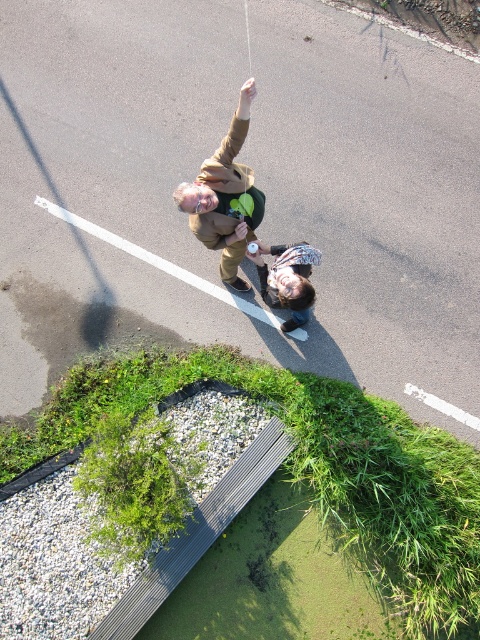
Between green grass at lower left and brown suede jacket at upper center, which one has more height?

green grass at lower left

Between green grass at lower left and brown suede jacket at upper center, which one is positioned higher?

Positioned higher is brown suede jacket at upper center.

Is point (371, 448) farther from camera compared to point (232, 180)?

Yes, point (371, 448) is behind point (232, 180).

Where is `green grass at lower left`? green grass at lower left is located at coordinates (286, 467).

Based on the photo, does green grass at lower left have a larger size compared to matte brown jacket at center?

Indeed, green grass at lower left has a larger size compared to matte brown jacket at center.

Who is more forward, (402, 417) or (295, 243)?

Point (402, 417) is in front.

Does point (247, 372) come behind point (277, 264)?

Yes, it is behind point (277, 264).

The height and width of the screenshot is (640, 480). Find the location of `green grass at lower left`. green grass at lower left is located at coordinates (286, 467).

Is brown suede jacket at upper center taller than matte brown jacket at center?

Yes, brown suede jacket at upper center is taller than matte brown jacket at center.

Is brown suede jacket at upper center thinner than matte brown jacket at center?

No.

Between point (207, 209) and point (254, 243), which one is positioned behind?

Positioned behind is point (254, 243).

At what (x,y) coordinates should I click in order to perform the action: click on brown suede jacket at upper center. Please return your answer as a coordinate pair (x, y). Looking at the image, I should click on (226, 196).